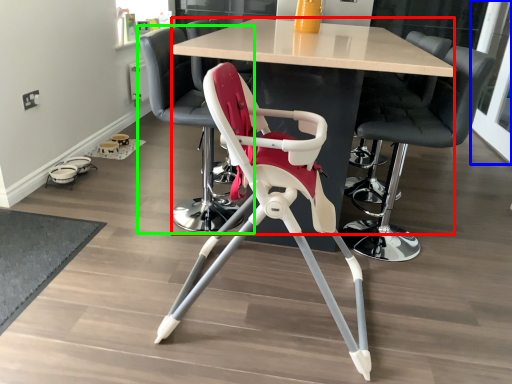
Question: Which object is positioned farthest from table (highlighted by a red box)? Select from glass door (highlighted by a blue box) and chair (highlighted by a green box).

Choices:
 (A) glass door
 (B) chair

Answer: (A)